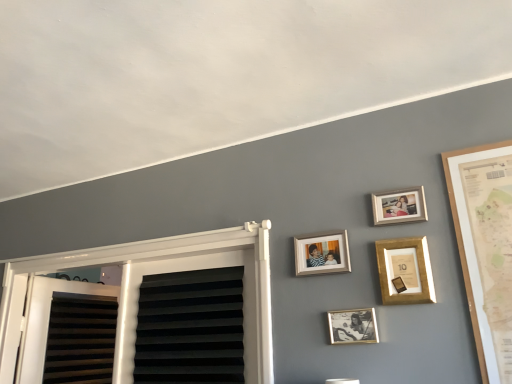
Question: Considering the relative sizes of wooden photo frame at upper right, acting as the first picture frame starting from the top, and wooden photo frame at center, placed as the 3th picture frame when sorted from bottom to top, in the image provided, is wooden photo frame at upper right, acting as the first picture frame starting from the top, shorter than wooden photo frame at center, placed as the 3th picture frame when sorted from bottom to top,?

Choices:
 (A) no
 (B) yes

Answer: (B)

Question: From the image's perspective, is wooden photo frame at upper right, acting as the first picture frame starting from the top, over wooden photo frame at center, placed as the 3th picture frame when sorted from bottom to top?

Choices:
 (A) yes
 (B) no

Answer: (A)

Question: Does wooden photo frame at upper right, placed as the 4th picture frame when sorted from bottom to top, have a greater height compared to wooden photo frame at center, placed as the 3th picture frame when sorted from bottom to top?

Choices:
 (A) yes
 (B) no

Answer: (B)

Question: Considering the relative sizes of wooden photo frame at upper right, acting as the first picture frame starting from the top, and wooden photo frame at center, the 2th picture frame when ordered from top to bottom, in the image provided, is wooden photo frame at upper right, acting as the first picture frame starting from the top, thinner than wooden photo frame at center, the 2th picture frame when ordered from top to bottom,?

Choices:
 (A) yes
 (B) no

Answer: (A)

Question: Can you confirm if wooden photo frame at upper right, acting as the first picture frame starting from the top, is positioned to the left of wooden photo frame at center, placed as the 3th picture frame when sorted from bottom to top?

Choices:
 (A) yes
 (B) no

Answer: (B)

Question: Is wooden photo frame at upper right, placed as the 4th picture frame when sorted from bottom to top, turned away from wooden photo frame at center, the 2th picture frame when ordered from top to bottom?

Choices:
 (A) no
 (B) yes

Answer: (A)

Question: Does wooden photo frame at center, the 2th picture frame when ordered from top to bottom, come behind gold metallic picture frame at upper center, acting as the second picture frame starting from the bottom?

Choices:
 (A) no
 (B) yes

Answer: (B)

Question: Does wooden photo frame at center, placed as the 3th picture frame when sorted from bottom to top, have a greater height compared to gold metallic picture frame at upper center, acting as the second picture frame starting from the bottom?

Choices:
 (A) no
 (B) yes

Answer: (A)

Question: Is wooden photo frame at center, placed as the 3th picture frame when sorted from bottom to top, facing away from gold metallic picture frame at upper center, acting as the second picture frame starting from the bottom?

Choices:
 (A) no
 (B) yes

Answer: (A)

Question: Is wooden photo frame at center, placed as the 3th picture frame when sorted from bottom to top, in front of gold metallic picture frame at upper center, which is counted as the third picture frame, starting from the top?

Choices:
 (A) yes
 (B) no

Answer: (B)

Question: Is wooden photo frame at center, the 2th picture frame when ordered from top to bottom, not within gold metallic picture frame at upper center, acting as the second picture frame starting from the bottom?

Choices:
 (A) no
 (B) yes

Answer: (B)

Question: Are wooden photo frame at center, placed as the 3th picture frame when sorted from bottom to top, and gold metallic picture frame at upper center, acting as the second picture frame starting from the bottom, located far from each other?

Choices:
 (A) yes
 (B) no

Answer: (B)

Question: Does gold-framed photo at center, acting as the first picture frame starting from the bottom, appear on the left side of wooden photo frame at upper right, placed as the 4th picture frame when sorted from bottom to top?

Choices:
 (A) no
 (B) yes

Answer: (B)